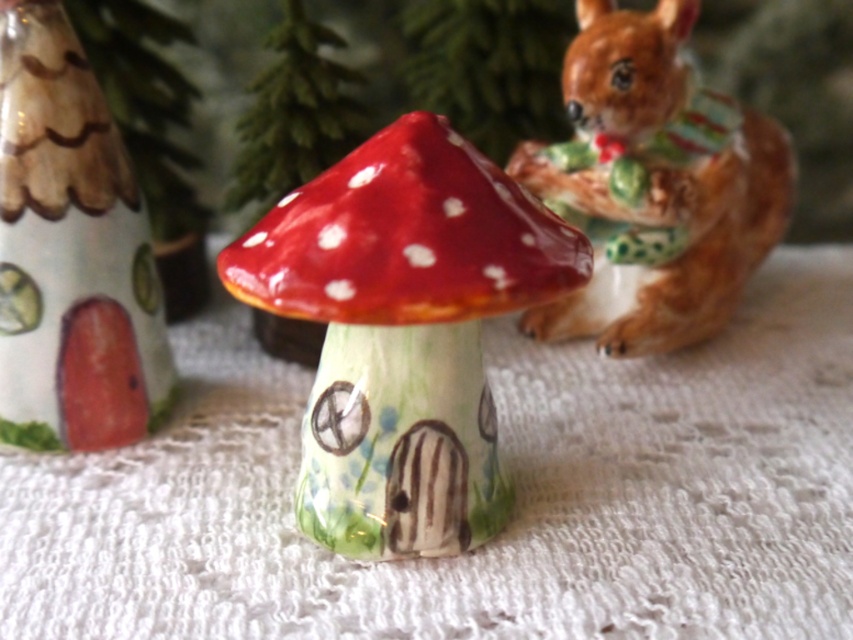
You are setting up a tea party and need to place a teapot on the white lace tablecloth at center. However, there is a brown glossy squirrel at upper right nearby. Where should you place the teapot to avoid the squirrel?

The white lace tablecloth at center is positioned on the left side of the brown glossy squirrel at upper right, so placing the teapot on the left side of the tablecloth would keep it away from the squirrel.

You are setting up a tea party for two guests and need to place two teacups on the white lace tablecloth at center. However, you also want to ensure that the brown glossy squirrel at upper right is visible to both guests. Where should you position the teacups on the tablecloth to keep the squirrel in view?

Place the teacups near the edge of the white lace tablecloth at center closest to the brown glossy squirrel at upper right. Since they are only 9.72 inches apart, positioning the cups closer to the squirrel ensures it remains visible to both guests while leaving enough space for the tea setup.